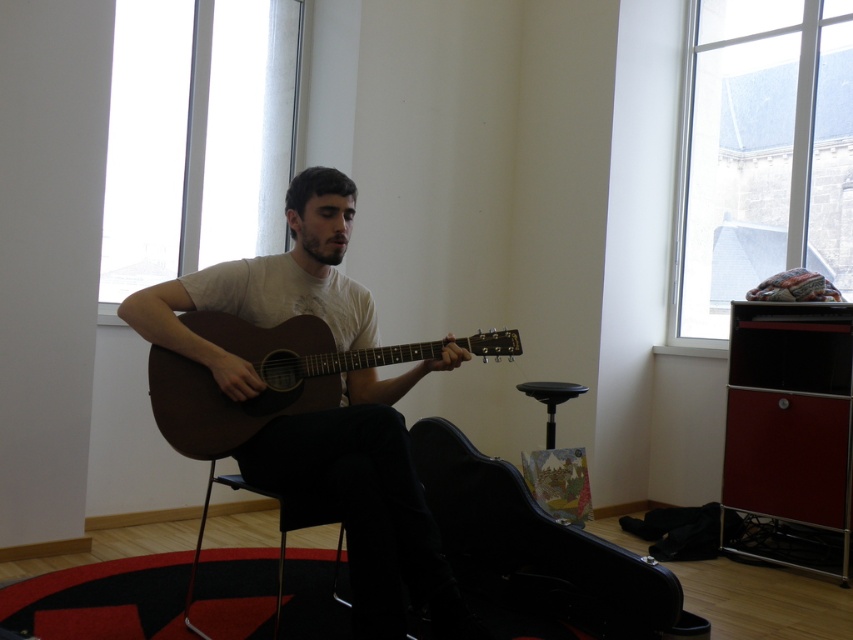
You are a photographer setting up for a session in this room. You need to place a small stool between the black hard case at lower center and the metallic black chair at center. Based on their positions, where should the stool be placed relative to the chair?

The black hard case at lower center is below the metallic black chair at center, so the stool should be placed between them, below the chair and above the case.

You are a photographer setting up for a shoot. You need to position a light source so that it illuminates the matte brown guitar at center without casting a shadow on the black plastic stool at center. Based on the scene description, where should you place the light source relative to the guitar and stool?

The matte brown guitar at center is located above the black plastic stool at center. To avoid casting a shadow on the stool, the light source should be placed directly above the guitar so that the shadow falls behind or beside it, not onto the stool.

You are a photographer setting up for a session and need to place a tripod between the black hard case at lower center and the metallic black chair at center. Which object should the tripod be placed closer to if you want it to be near the taller object?

The black hard case at lower center is taller than the metallic black chair at center, so the tripod should be placed closer to the black hard case at lower center.